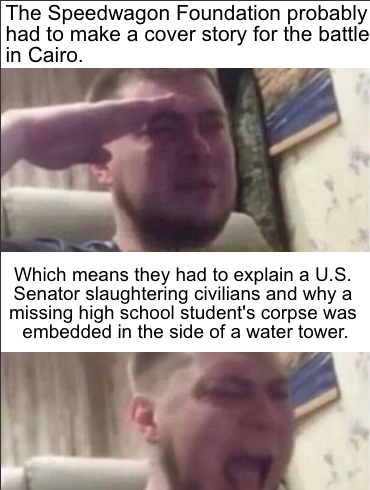
I want to click on chair, so coord(74,221).